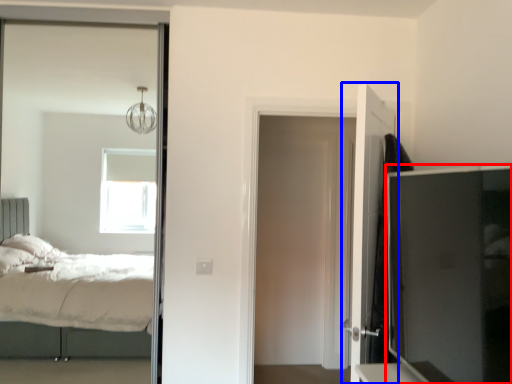
Question: Which of the following is the farthest to the observer, tv cabinet (highlighted by a red box) or door (highlighted by a blue box)?

Choices:
 (A) tv cabinet
 (B) door

Answer: (B)